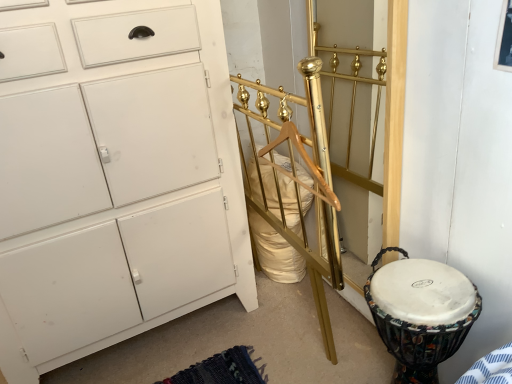
Question: Should I look upward or downward to see gold polished metal bed frame at center?

Choices:
 (A) up
 (B) down

Answer: (B)

Question: Considering the relative sizes of white fabric-covered drum at lower right and white matte cabinet at left in the image provided, is white fabric-covered drum at lower right thinner than white matte cabinet at left?

Choices:
 (A) no
 (B) yes

Answer: (B)

Question: Is white fabric-covered drum at lower right next to white matte cabinet at left?

Choices:
 (A) no
 (B) yes

Answer: (A)

Question: Considering the relative sizes of white fabric-covered drum at lower right and white matte cabinet at left in the image provided, is white fabric-covered drum at lower right taller than white matte cabinet at left?

Choices:
 (A) no
 (B) yes

Answer: (A)

Question: Does white fabric-covered drum at lower right have a larger size compared to white matte cabinet at left?

Choices:
 (A) no
 (B) yes

Answer: (A)

Question: Could you tell me if white fabric-covered drum at lower right is facing white matte cabinet at left?

Choices:
 (A) no
 (B) yes

Answer: (A)

Question: Is white fabric-covered drum at lower right closer to camera compared to white matte cabinet at left?

Choices:
 (A) yes
 (B) no

Answer: (B)

Question: Is white fabric-covered drum at lower right completely or partially outside of gold polished metal bed frame at center?

Choices:
 (A) no
 (B) yes

Answer: (B)

Question: Is there a large distance between white fabric-covered drum at lower right and gold polished metal bed frame at center?

Choices:
 (A) no
 (B) yes

Answer: (A)

Question: Considering the relative sizes of white fabric-covered drum at lower right and gold polished metal bed frame at center in the image provided, is white fabric-covered drum at lower right thinner than gold polished metal bed frame at center?

Choices:
 (A) yes
 (B) no

Answer: (B)

Question: From a real-world perspective, is white fabric-covered drum at lower right under gold polished metal bed frame at center?

Choices:
 (A) no
 (B) yes

Answer: (B)

Question: Is white fabric-covered drum at lower right smaller than gold polished metal bed frame at center?

Choices:
 (A) yes
 (B) no

Answer: (A)

Question: Does white fabric-covered drum at lower right have a greater width compared to gold polished metal bed frame at center?

Choices:
 (A) no
 (B) yes

Answer: (B)

Question: Is gold polished metal bed frame at center bigger than white fabric-covered drum at lower right?

Choices:
 (A) yes
 (B) no

Answer: (A)